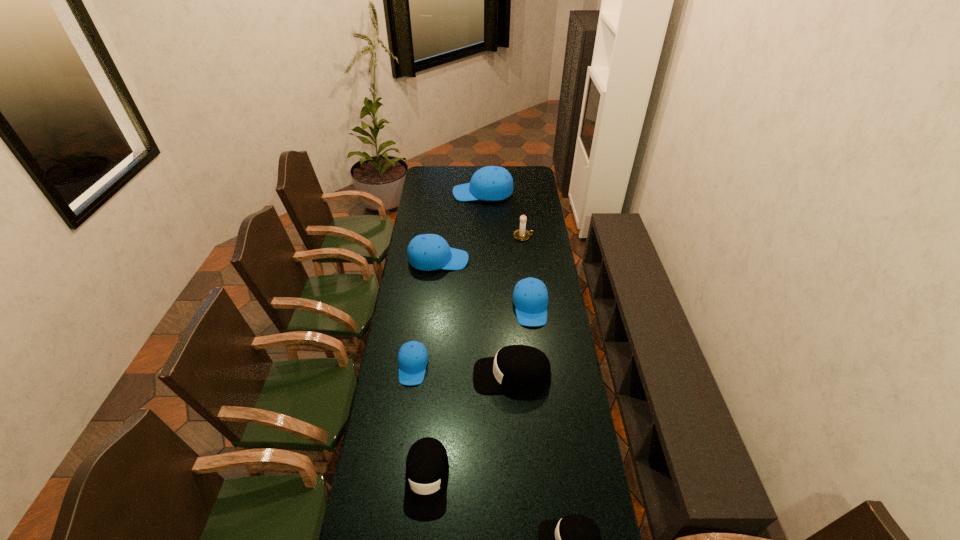
Where is `the farthest blue cap`? The image size is (960, 540). the farthest blue cap is located at coordinates (491, 183).

What are the coordinates of `the tallest cap` in the screenshot? It's located at (491, 183).

Where is `the third smallest blue cap`? The height and width of the screenshot is (540, 960). the third smallest blue cap is located at coordinates (427, 251).

I want to click on the third nearest blue cap, so click(x=427, y=251).

Locate an element on the screen. The image size is (960, 540). candle holder is located at coordinates (521, 234).

Where is `white candle holder`? white candle holder is located at coordinates (521, 234).

Find the location of a particular element. the farthest black cap is located at coordinates (516, 368).

You are a GUI agent. You are given a task and a screenshot of the screen. Output one action in this format:
    pyautogui.click(x=<x>, y=<y>)
    Task: Click on the fifth nearest cap
    The width and height of the screenshot is (960, 540).
    Given the screenshot: What is the action you would take?
    pyautogui.click(x=530, y=297)

The image size is (960, 540). In order to click on the third farthest blue cap in this screenshot , I will do `click(530, 297)`.

You are a GUI agent. You are given a task and a screenshot of the screen. Output one action in this format:
    pyautogui.click(x=<x>, y=<y>)
    Task: Click on the leftmost black cap
    Image resolution: width=960 pixels, height=540 pixels.
    Given the screenshot: What is the action you would take?
    pyautogui.click(x=427, y=466)